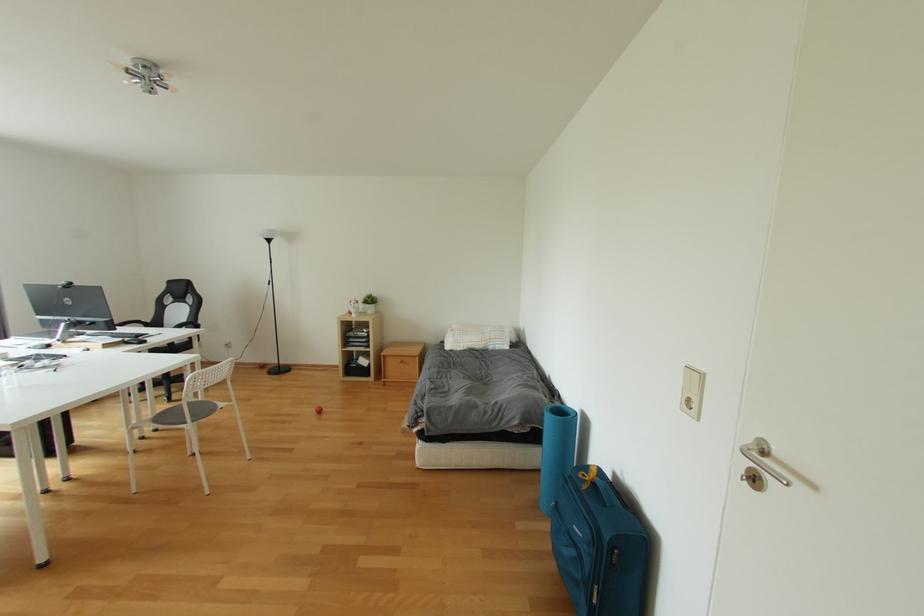
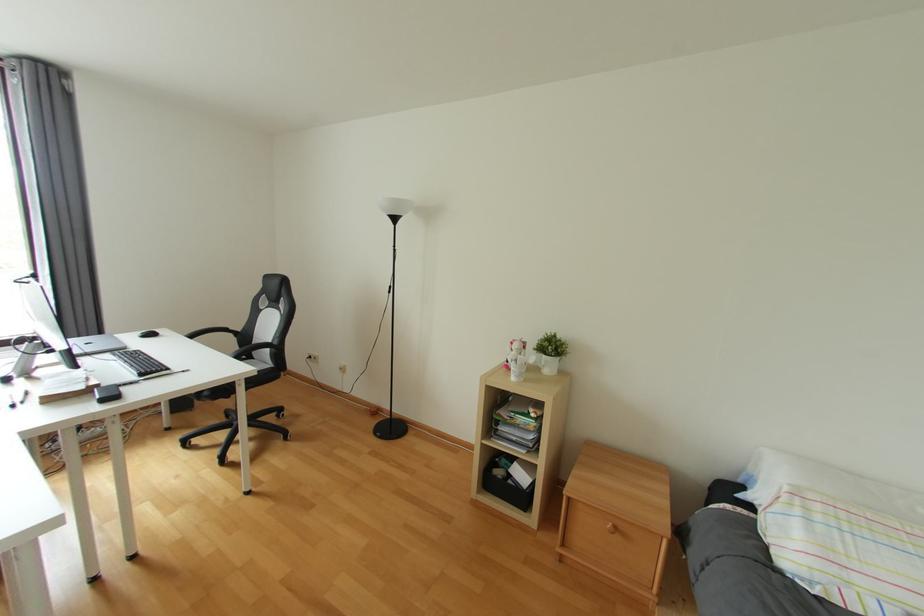
Question: The images are taken continuously from a first-person perspective. In which direction are you moving?

Choices:
 (A) Left
 (B) Right
 (C) Forward
 (D) Backward

Answer: (C)